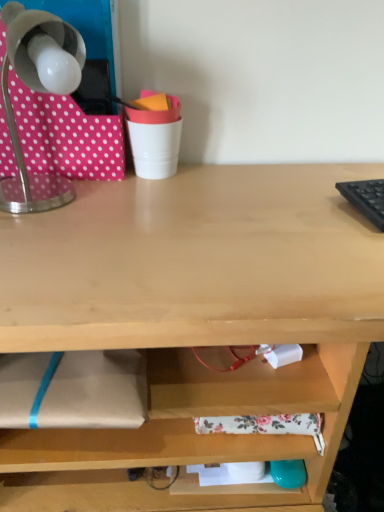
Question: Is metallic gray lamp at upper left facing towards white plastic cup at upper center?

Choices:
 (A) no
 (B) yes

Answer: (A)

Question: Would you say white plastic cup at upper center is part of metallic gray lamp at upper left's contents?

Choices:
 (A) yes
 (B) no

Answer: (B)

Question: From the image's perspective, would you say metallic gray lamp at upper left is shown under white plastic cup at upper center?

Choices:
 (A) no
 (B) yes

Answer: (B)

Question: Does metallic gray lamp at upper left have a greater height compared to white plastic cup at upper center?

Choices:
 (A) no
 (B) yes

Answer: (B)

Question: Is metallic gray lamp at upper left at the left side of white plastic cup at upper center?

Choices:
 (A) no
 (B) yes

Answer: (B)

Question: Is metallic gray lamp at upper left further to the viewer compared to white plastic cup at upper center?

Choices:
 (A) no
 (B) yes

Answer: (A)

Question: From the image's perspective, does pink polka dot fabric at upper left appear lower than white plastic cup at upper center?

Choices:
 (A) yes
 (B) no

Answer: (B)

Question: Can you confirm if pink polka dot fabric at upper left is smaller than white plastic cup at upper center?

Choices:
 (A) yes
 (B) no

Answer: (B)

Question: Can you confirm if pink polka dot fabric at upper left is shorter than white plastic cup at upper center?

Choices:
 (A) yes
 (B) no

Answer: (B)

Question: From the image's perspective, is pink polka dot fabric at upper left over white plastic cup at upper center?

Choices:
 (A) yes
 (B) no

Answer: (A)

Question: Is pink polka dot fabric at upper left to the right of white plastic cup at upper center from the viewer's perspective?

Choices:
 (A) yes
 (B) no

Answer: (B)

Question: Is white plastic cup at upper center a part of pink polka dot fabric at upper left?

Choices:
 (A) yes
 (B) no

Answer: (B)

Question: Is pink polka dot fabric at upper left at the right side of metallic gray lamp at upper left?

Choices:
 (A) no
 (B) yes

Answer: (A)